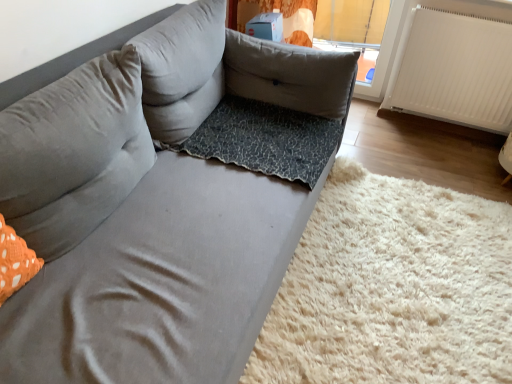
The width and height of the screenshot is (512, 384). I want to click on empty space that is ontop of white ribbed radiator at right, so click(472, 13).